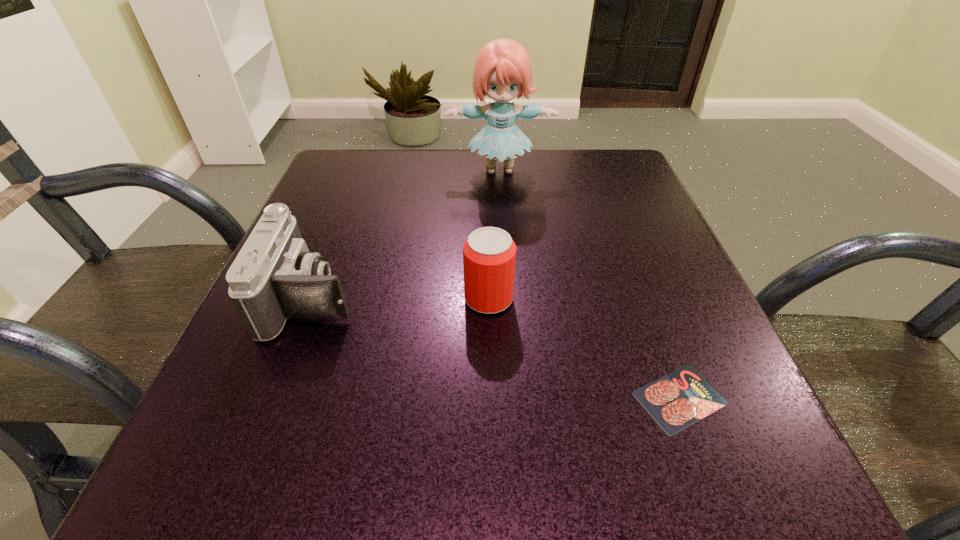
Where is `vacant area that lies between the leftmost object and the farthest object`? This screenshot has width=960, height=540. vacant area that lies between the leftmost object and the farthest object is located at coordinates (406, 234).

Identify the location of object that is the second closest to the shortest object. (274, 277).

Where is `object that ranks as the third closest to the beer can`? object that ranks as the third closest to the beer can is located at coordinates (503, 71).

This screenshot has height=540, width=960. Find the location of `vacant region that satisfies the following two spatial constraints: 1. at the front of the camera with an open lens cover; 2. on the left side of the shortest object`. vacant region that satisfies the following two spatial constraints: 1. at the front of the camera with an open lens cover; 2. on the left side of the shortest object is located at coordinates (275, 397).

You are a GUI agent. You are given a task and a screenshot of the screen. Output one action in this format:
    pyautogui.click(x=<x>, y=<y>)
    Task: Click on the vacant space that satisfies the following two spatial constraints: 1. at the front of the shortest object with an open lens cover; 2. on the right side of the leftmost object
    
    Given the screenshot: What is the action you would take?
    pyautogui.click(x=275, y=397)

This screenshot has height=540, width=960. I want to click on vacant space that satisfies the following two spatial constraints: 1. at the front of the leftmost object with an open lens cover; 2. on the back side of the beer can, so click(x=313, y=299).

The image size is (960, 540). What are the coordinates of `vacant space that satisfies the following two spatial constraints: 1. at the front of the camera with an open lens cover; 2. on the left side of the shortest object` in the screenshot? It's located at (275, 397).

Identify the location of vacant space that satisfies the following two spatial constraints: 1. on the back side of the rightmost object; 2. at the front of the leftmost object with an open lens cover. The image size is (960, 540). (642, 298).

The image size is (960, 540). Identify the location of vacant area in the image that satisfies the following two spatial constraints: 1. at the front of the leftmost object with an open lens cover; 2. on the right side of the beer can. (313, 299).

At what (x,y) coordinates should I click in order to perform the action: click on free space that satisfies the following two spatial constraints: 1. at the front of the beer can with an open lens cover; 2. on the right side of the leftmost object. Please return your answer as a coordinate pair (x, y). Looking at the image, I should click on (313, 299).